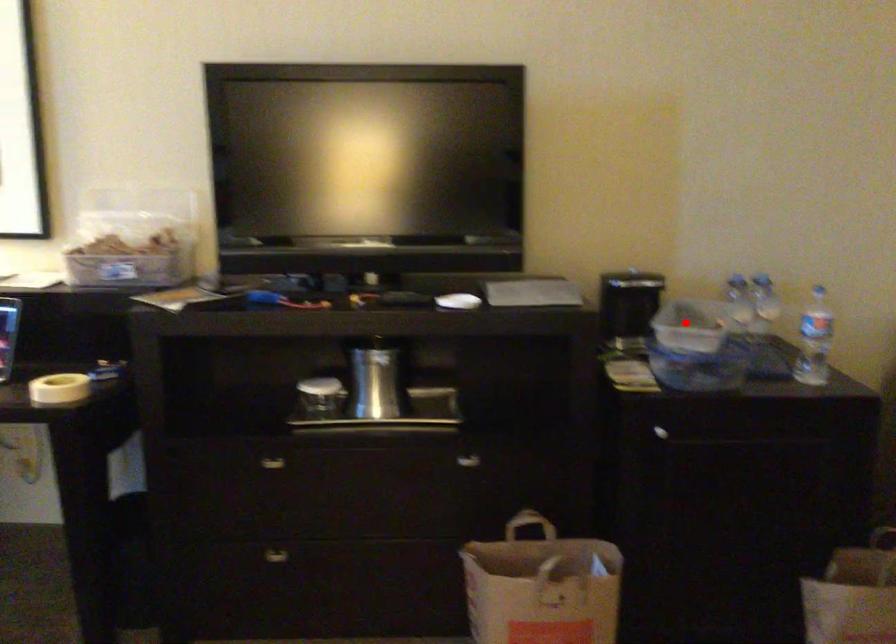
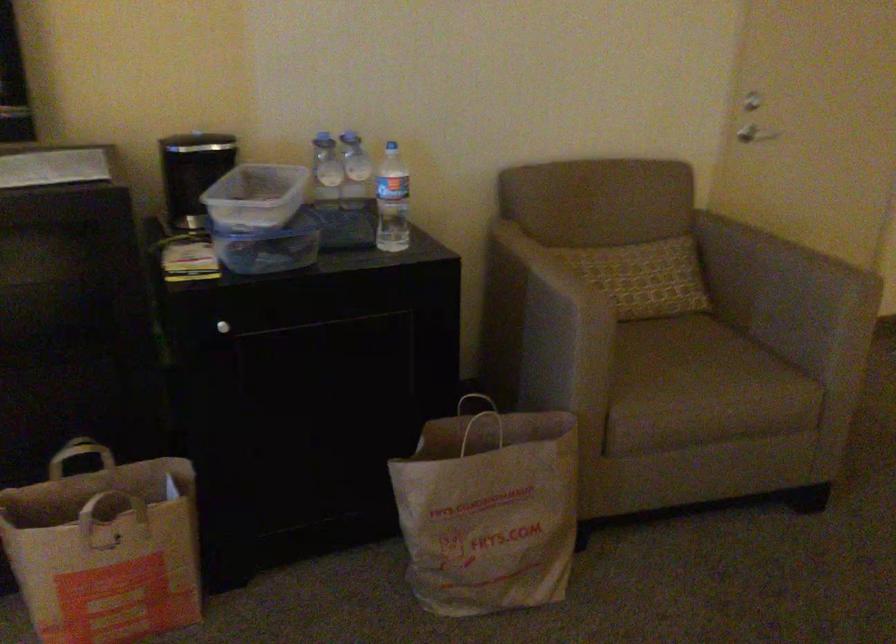
Question: A red point is marked in image1. In image2, is the corresponding 3D point closer to the camera or farther? Reply with the corresponding letter.

Choices:
 (A) The corresponding 3D point is closer.
 (B) The corresponding 3D point is farther.

Answer: (A)